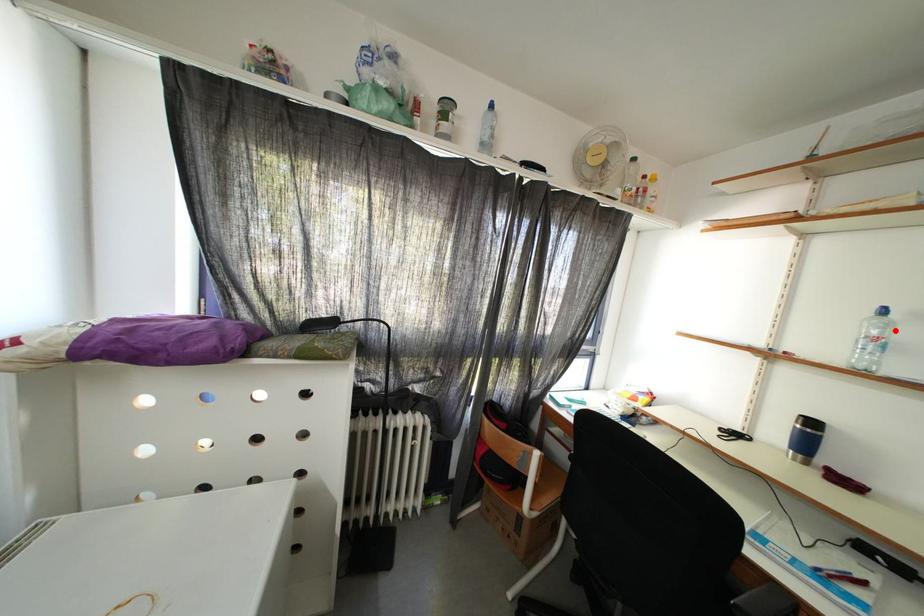
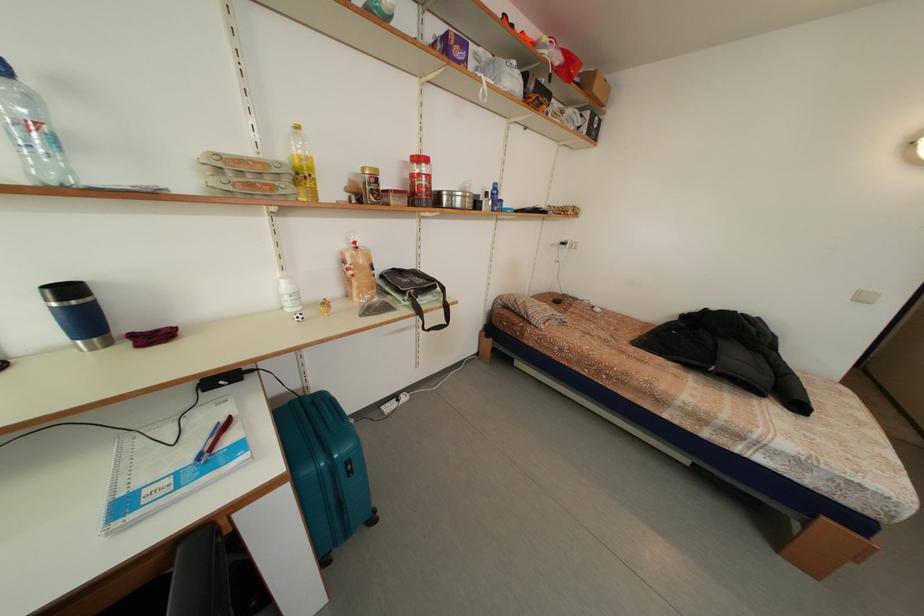
Question: I am providing you with two images of the same scene from different viewpoints. A red point is shown in image1. For the corresponding object point in image2, is it positioned nearer or farther from the camera?

Choices:
 (A) Nearer
 (B) Farther

Answer: (B)